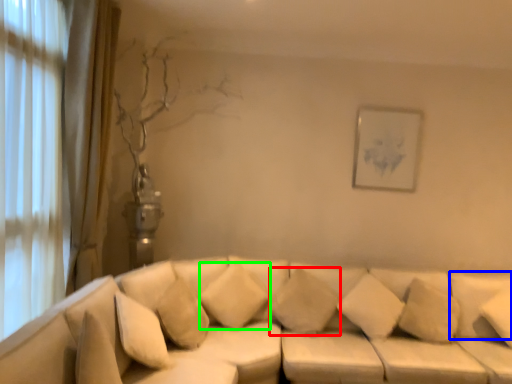
Question: Considering the real-world distances, which object is closest to pillow (highlighted by a red box)? pillow (highlighted by a blue box) or pillow (highlighted by a green box).

Choices:
 (A) pillow
 (B) pillow

Answer: (B)